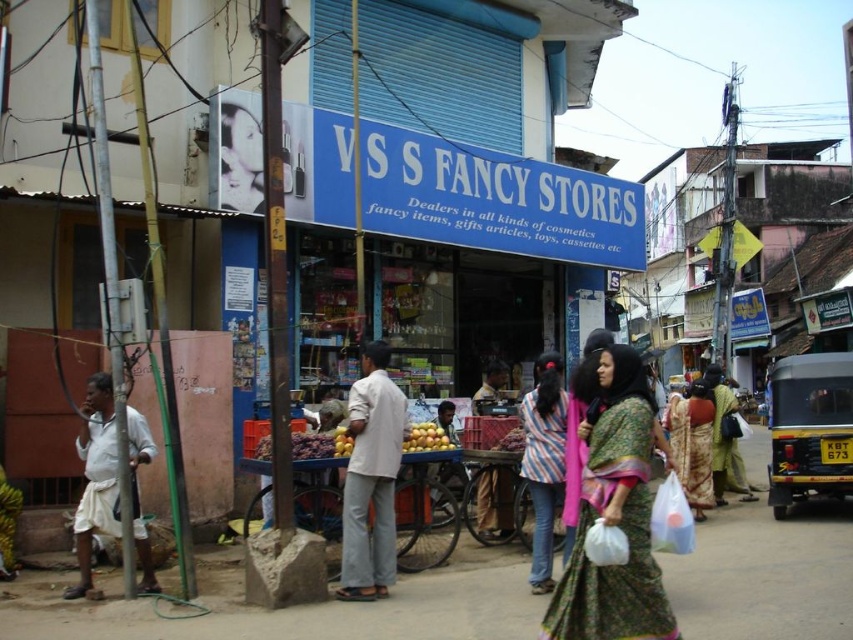
Does green floral saree at center have a greater width compared to yellow matte oranges at center?

Indeed, green floral saree at center has a greater width compared to yellow matte oranges at center.

Describe the element at coordinates (692, 444) in the screenshot. I see `green floral saree at center` at that location.

The height and width of the screenshot is (640, 853). Identify the location of green floral saree at center. (692, 444).

Who is taller, green printed sari at center or yellow matte oranges at center?

Standing taller between the two is green printed sari at center.

Does green printed sari at center have a greater height compared to yellow matte oranges at center?

Indeed, green printed sari at center has a greater height compared to yellow matte oranges at center.

You are a GUI agent. You are given a task and a screenshot of the screen. Output one action in this format:
    pyautogui.click(x=<x>, y=<y>)
    Task: Click on the green printed sari at center
    The height and width of the screenshot is (640, 853).
    Given the screenshot: What is the action you would take?
    pyautogui.click(x=614, y=515)

Does green printed sari at center come behind white cloth at left?

That is False.

Where is `green printed sari at center`? Image resolution: width=853 pixels, height=640 pixels. green printed sari at center is located at coordinates (614, 515).